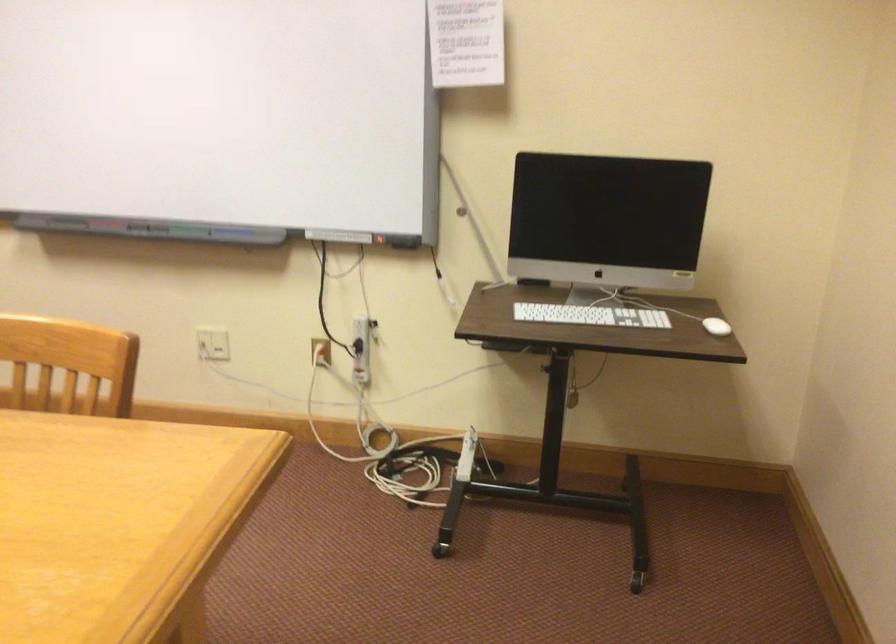
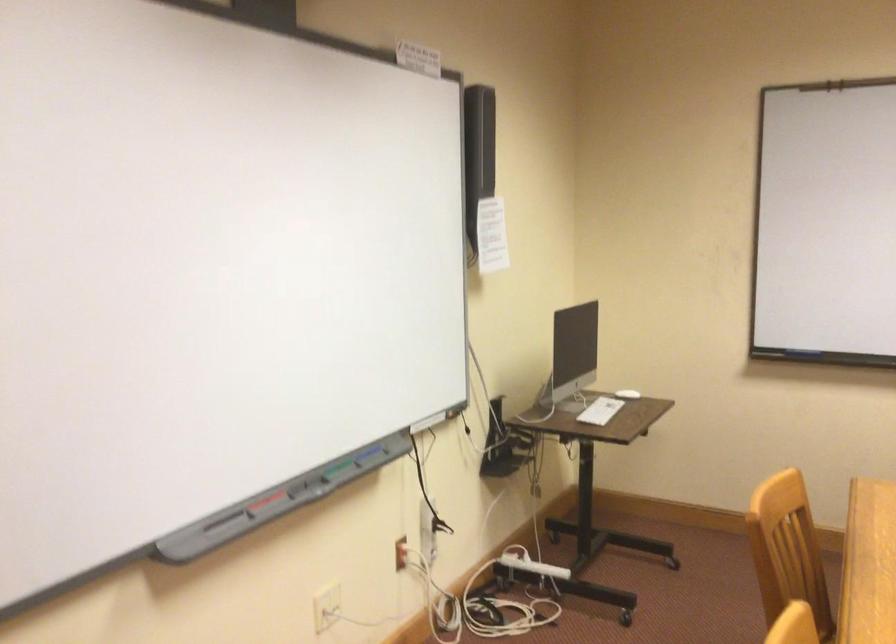
The point at (152,227) is marked in the first image. Where is the corresponding point in the second image?

(302, 484)